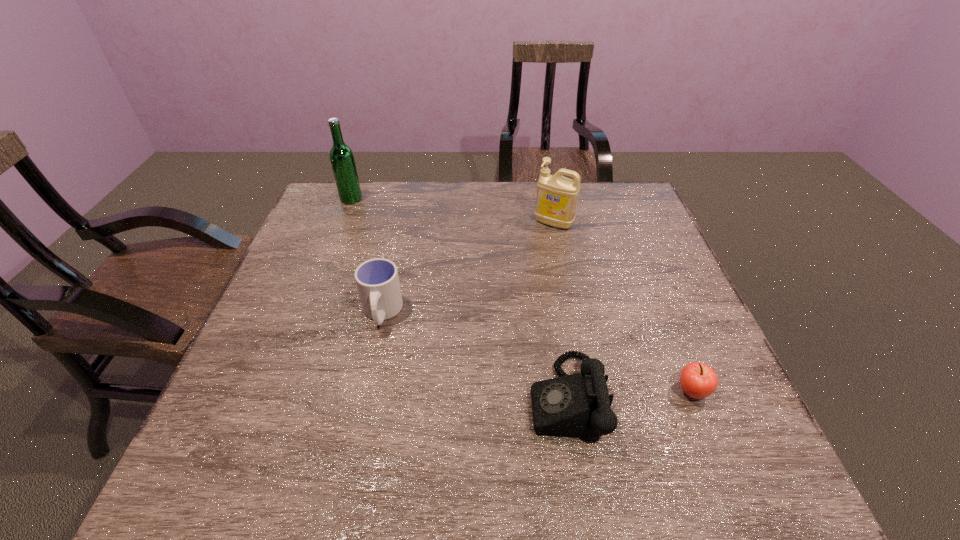
Find the location of a particular element. The width and height of the screenshot is (960, 540). free space located 0.340m on the left of the second tallest object is located at coordinates (420, 223).

The width and height of the screenshot is (960, 540). Find the location of `free region located with the handle on the side of the third nearest object`. free region located with the handle on the side of the third nearest object is located at coordinates 363,397.

Where is `vacant area located 0.200m on the dial of the telephone`? The height and width of the screenshot is (540, 960). vacant area located 0.200m on the dial of the telephone is located at coordinates (431, 398).

This screenshot has width=960, height=540. Find the location of `vacant space located 0.240m on the dial of the telephone`. vacant space located 0.240m on the dial of the telephone is located at coordinates (412, 398).

The height and width of the screenshot is (540, 960). What are the coordinates of `vacant space situated on the dial of the telephone` in the screenshot? It's located at (417, 398).

Locate an element on the screen. blank space located on the left of the shortest object is located at coordinates (578, 392).

Identify the location of beer bottle that is at the far edge. (342, 160).

I want to click on detergent that is at the far edge, so click(556, 201).

This screenshot has width=960, height=540. In order to click on object present at the near edge in this screenshot , I will do `click(579, 405)`.

The image size is (960, 540). Identify the location of object that is positioned at the left edge. (342, 160).